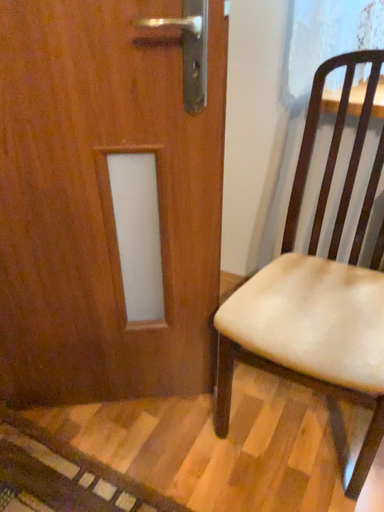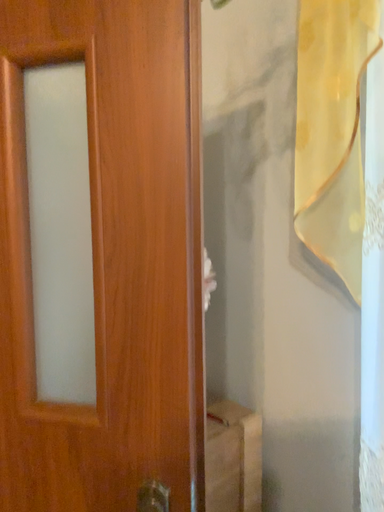
Question: How did the camera likely rotate when shooting the video?

Choices:
 (A) rotated left
 (B) rotated right

Answer: (A)